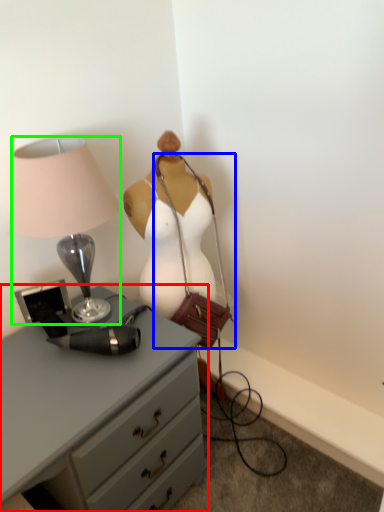
Question: Estimate the real-world distances between objects in this image. Which object is closer to chest of drawers (highlighted by a red box), handbag (highlighted by a blue box) or lamp (highlighted by a green box)?

Choices:
 (A) handbag
 (B) lamp

Answer: (B)